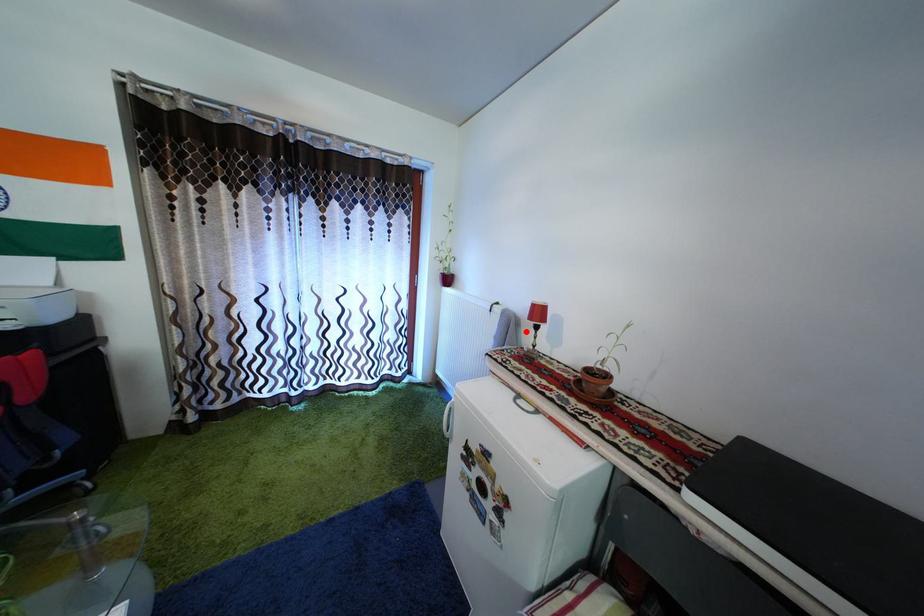
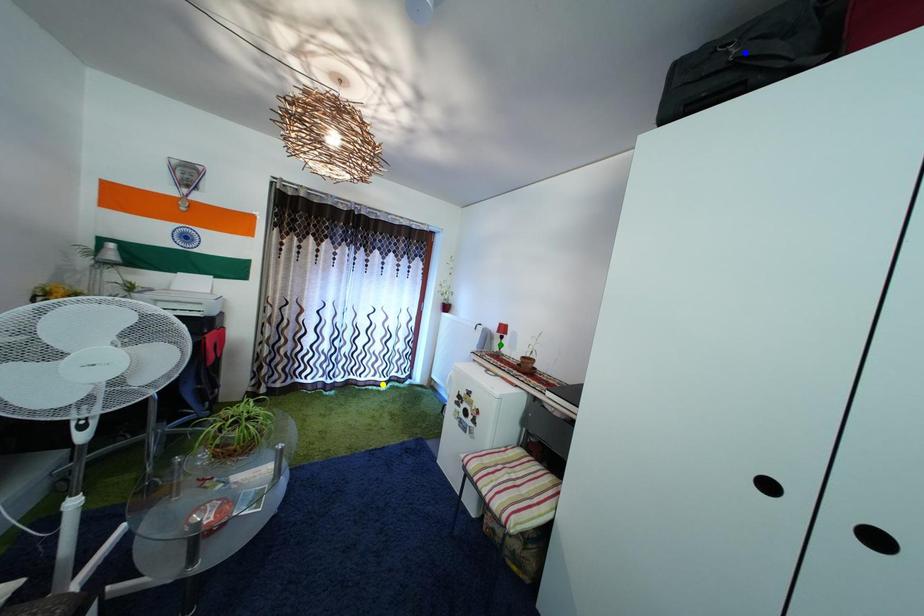
Question: I am providing you with two images of the same scene from different viewpoints. A red point is marked on the first image. You are given multiple points on the second image. Which point in image 2 is actually the same real-world point as the red point in image 1?

Choices:
 (A) green point
 (B) yellow point
 (C) blue point

Answer: (A)